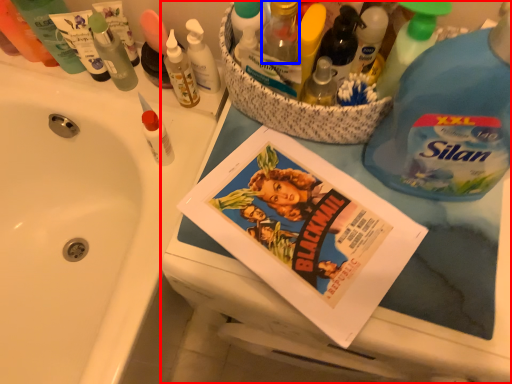
Question: Which of the following is the farthest to the observer, bathroom cabinet (highlighted by a red box) or toiletry (highlighted by a blue box)?

Choices:
 (A) bathroom cabinet
 (B) toiletry

Answer: (B)